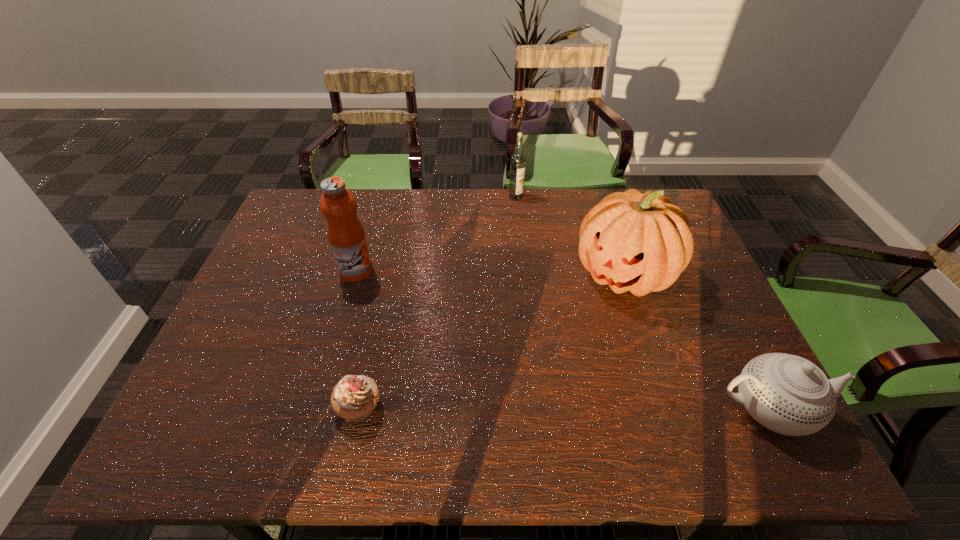
You are a GUI agent. You are given a task and a screenshot of the screen. Output one action in this format:
    pyautogui.click(x=<x>, y=<y>)
    Task: Click on the pumpkin that is at the right edge
    Image resolution: width=960 pixels, height=540 pixels.
    Given the screenshot: What is the action you would take?
    pyautogui.click(x=639, y=242)

This screenshot has width=960, height=540. What are the coordinates of `object present at the near right corner` in the screenshot? It's located at (787, 394).

At what (x,y) coordinates should I click in order to perform the action: click on vacant space at the far edge of the desktop. Please return your answer as a coordinate pair (x, y). Image resolution: width=960 pixels, height=540 pixels. Looking at the image, I should click on (x=454, y=188).

In order to click on free location at the near edge in this screenshot , I will do `click(486, 403)`.

The width and height of the screenshot is (960, 540). I want to click on vacant point at the far left corner, so click(318, 195).

At what (x,y) coordinates should I click in order to perform the action: click on free space between the second shortest object and the cupcake. Please return your answer as a coordinate pair (x, y). Image resolution: width=960 pixels, height=540 pixels. Looking at the image, I should click on (564, 408).

Identify the location of free space between the fruit juice and the third object from left to right. (436, 234).

You are a GUI agent. You are given a task and a screenshot of the screen. Output one action in this format:
    pyautogui.click(x=<x>, y=<y>)
    Task: Click on the free space between the fruit juice and the farthest object
    
    Given the screenshot: What is the action you would take?
    pyautogui.click(x=436, y=234)

Locate an element on the screen. The image size is (960, 540). free area in between the cupcake and the pumpkin is located at coordinates (492, 341).

What are the coordinates of `blank region between the fruit juice and the farthest object` in the screenshot? It's located at (436, 234).